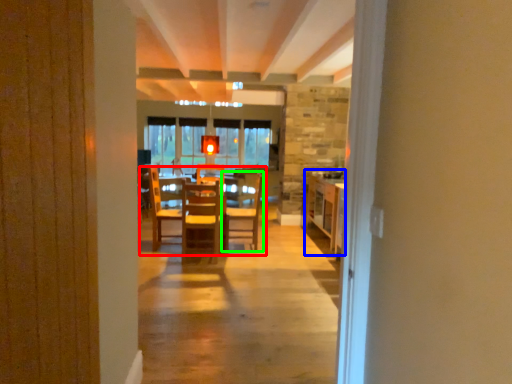
Question: Which object is the closest to the table (highlighted by a red box)? Choose among these: table (highlighted by a blue box) or chair (highlighted by a green box).

Choices:
 (A) table
 (B) chair

Answer: (B)